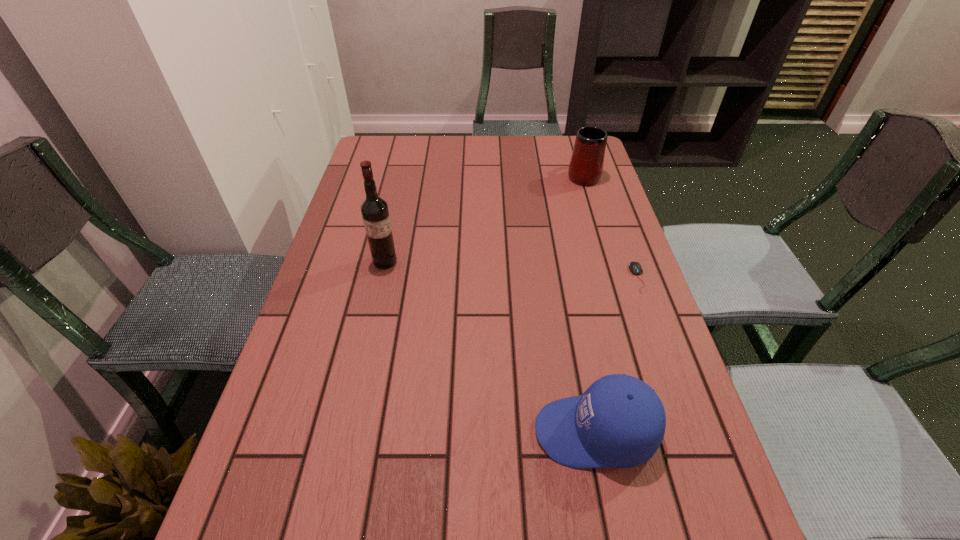
Where is `object that is at the far right corner`? object that is at the far right corner is located at coordinates (586, 165).

You are a GUI agent. You are given a task and a screenshot of the screen. Output one action in this format:
    pyautogui.click(x=<x>, y=<y>)
    Task: Click on the vacant space at the far edge of the desktop
    
    Given the screenshot: What is the action you would take?
    pyautogui.click(x=433, y=154)

In the image, there is a desktop. In order to click on free space at the left edge in this screenshot , I will do `click(355, 181)`.

The height and width of the screenshot is (540, 960). Find the location of `blank space at the right edge of the desktop`. blank space at the right edge of the desktop is located at coordinates (656, 489).

At what (x,y) coordinates should I click in order to perform the action: click on free space between the leftmost object and the farthest object. Please return your answer as a coordinate pair (x, y). Image resolution: width=960 pixels, height=540 pixels. Looking at the image, I should click on (484, 218).

Identify the location of free space between the shortest object and the tallest object. (512, 269).

What are the coordinates of `free space between the leftmost object and the shortest object` in the screenshot? It's located at (512, 269).

I want to click on vacant region between the tallest object and the nearest object, so click(x=490, y=347).

Where is `free space between the mug and the shortest object`? free space between the mug and the shortest object is located at coordinates (611, 226).

At what (x,y) coordinates should I click in order to perform the action: click on vacant area between the shortest object and the farthest object. Please return your answer as a coordinate pair (x, y). The height and width of the screenshot is (540, 960). Looking at the image, I should click on (611, 226).